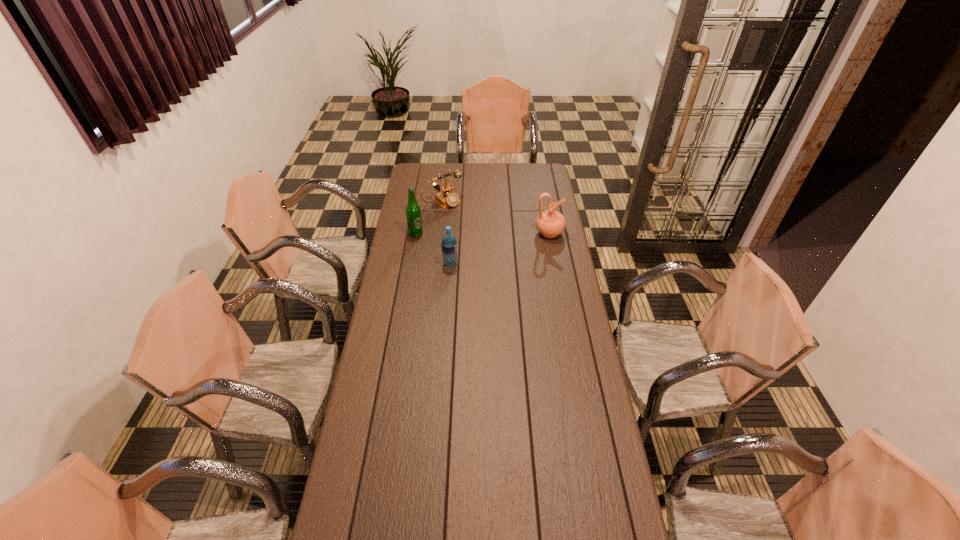
I want to click on vacant spot on the desktop that is between the water bottle and the pottery and is positioned on the dial number of the farthest object, so click(x=496, y=249).

Locate an element on the screen. The height and width of the screenshot is (540, 960). vacant space on the desktop that is between the nearest object and the rightmost object and is positioned on the label of the beer bottle is located at coordinates (501, 248).